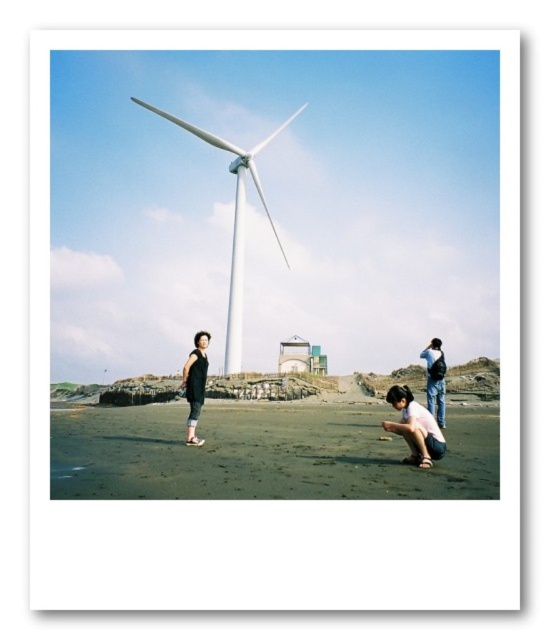
Looking at this image, you are a photographer trying to capture the white matte wind turbine at center and the dark gray fabric dress at lower center in a single shot. Can you position yourself so that both are visible without the dress blocking the turbine?

The dark gray fabric dress at lower center is behind the white matte wind turbine at center, so positioning yourself so that both are visible without the dress blocking the turbine is possible since the dress is behind the turbine and not in front of it.

Looking at this image, you are a photographer setting up equipment on the beach. You need to place a tripod between the dark sand at lower center and the matte black backpack at lower right. Which object should you place the tripod closer to if you want it to be on higher ground?

The dark sand at lower center is not as tall as the matte black backpack at lower right, so the matte black backpack at lower right is higher. Place the tripod closer to the matte black backpack at lower right to be on higher ground.